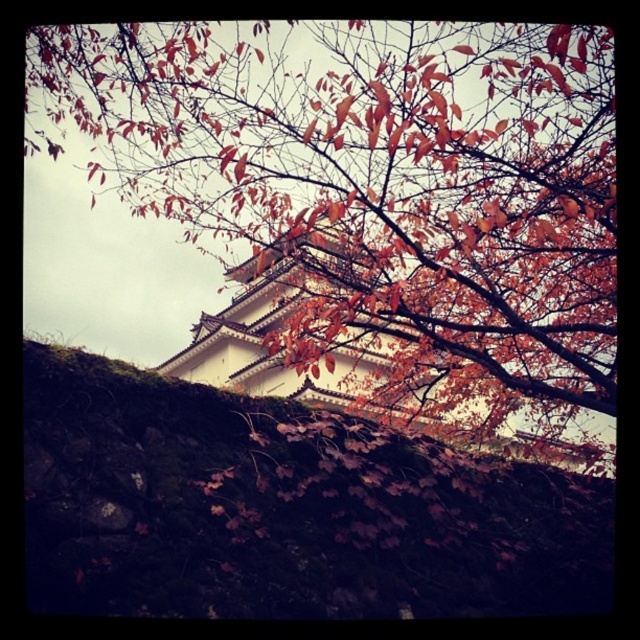
In the scene shown: Can you confirm if autumn leaves at upper center is taller than mossy stone wall at lower center?

Yes, autumn leaves at upper center is taller than mossy stone wall at lower center.

The height and width of the screenshot is (640, 640). Describe the element at coordinates (381, 189) in the screenshot. I see `autumn leaves at upper center` at that location.

Which is in front, point (384, 138) or point (120, 518)?

Positioned in front is point (120, 518).

Find the location of a particular element. The image size is (640, 640). autumn leaves at upper center is located at coordinates (381, 189).